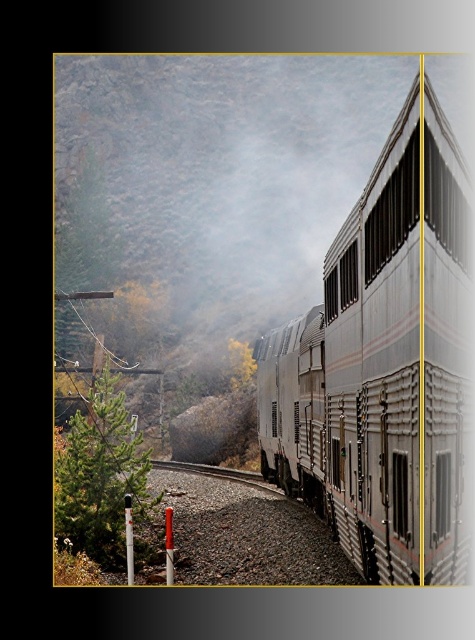
You are a photographer trying to capture the silver metallic train at center and the green matte tree at lower left in the same frame. Which object will appear narrower in the photo?

The silver metallic train at center will appear narrower in the photo because it is thinner than the green matte tree at lower left.

You are a photographer trying to capture the silver metallic train at center and the green matte tree at lower left in a single frame. Based on their sizes in the image, which object would appear closer to the camera?

The green matte tree at lower left appears closer to the camera because it is larger in size compared to the silver metallic train at center.

In the scene shown: You are a passenger on the silver metallic train at center and want to look out the window to see the green matte tree at lower left. Based on the train and tree positions, which side of the train should you look out of to see the tree?

The silver metallic train at center is positioned on the right side of the green matte tree at lower left. Therefore, you should look out the left side of the train to see the green matte tree at lower left.